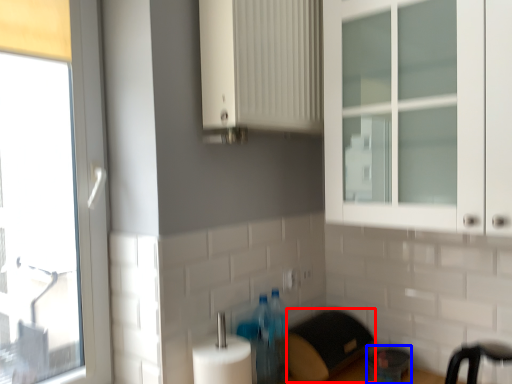
Question: Which object appears closest to the camera in this image, appliance (highlighted by a red box) or appliance (highlighted by a blue box)?

Choices:
 (A) appliance
 (B) appliance

Answer: (A)